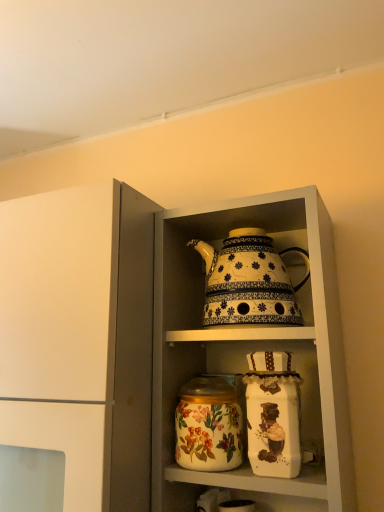
Question: From their relative heights in the image, would you say white glossy teapot at upper center is taller or shorter than floral-patterned ceramic jar at center?

Choices:
 (A) short
 (B) tall

Answer: (B)

Question: Would you say white glossy teapot at upper center is inside or outside floral-patterned ceramic jar at center?

Choices:
 (A) inside
 (B) outside

Answer: (B)

Question: Which of these objects is positioned closest to the white glossy teapot at upper center?

Choices:
 (A) floral-patterned ceramic jar at center
 (B) decorative ceramic teapot at center
 (C) white glossy teapot at upper center

Answer: (C)

Question: Considering the real-world distances, which object is farthest from the white glossy teapot at upper center?

Choices:
 (A) white glossy teapot at upper center
 (B) floral-patterned ceramic jar at center
 (C) decorative ceramic teapot at center

Answer: (B)